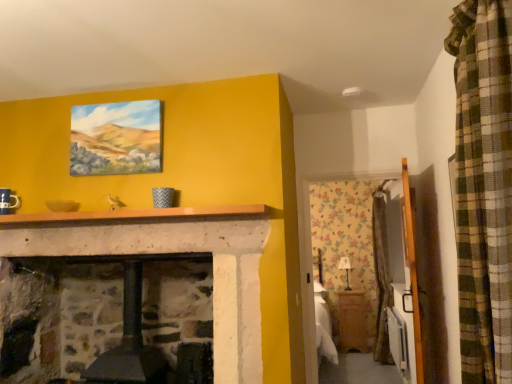
Question: Is wooden cabinet at lower right touching matte canvas painting at upper center?

Choices:
 (A) no
 (B) yes

Answer: (A)

Question: Can you confirm if wooden cabinet at lower right is taller than matte canvas painting at upper center?

Choices:
 (A) yes
 (B) no

Answer: (A)

Question: From the image's perspective, is wooden cabinet at lower right beneath matte canvas painting at upper center?

Choices:
 (A) yes
 (B) no

Answer: (A)

Question: Is matte canvas painting at upper center at the back of wooden cabinet at lower right?

Choices:
 (A) yes
 (B) no

Answer: (B)

Question: Does wooden cabinet at lower right have a lesser height compared to matte canvas painting at upper center?

Choices:
 (A) no
 (B) yes

Answer: (A)

Question: Considering the positions of point (129, 150) and point (416, 292), is point (129, 150) closer or farther from the camera than point (416, 292)?

Choices:
 (A) farther
 (B) closer

Answer: (A)

Question: Relative to wooden armoire at right, is matte canvas painting at upper center in front or behind?

Choices:
 (A) front
 (B) behind

Answer: (B)

Question: Looking at their shapes, would you say matte canvas painting at upper center is wider or thinner than wooden armoire at right?

Choices:
 (A) wide
 (B) thin

Answer: (B)

Question: Visually, is matte canvas painting at upper center positioned to the left or to the right of wooden armoire at right?

Choices:
 (A) left
 (B) right

Answer: (A)

Question: From the image's perspective, is wooden cabinet at lower right above or below wooden armoire at right?

Choices:
 (A) below
 (B) above

Answer: (A)

Question: Considering the relative positions of wooden cabinet at lower right and wooden armoire at right in the image provided, is wooden cabinet at lower right to the left or to the right of wooden armoire at right?

Choices:
 (A) left
 (B) right

Answer: (B)

Question: In the image, is wooden cabinet at lower right positioned in front of or behind wooden armoire at right?

Choices:
 (A) front
 (B) behind

Answer: (B)

Question: Considering the positions of point (347, 296) and point (419, 309), is point (347, 296) closer or farther from the camera than point (419, 309)?

Choices:
 (A) closer
 (B) farther

Answer: (B)

Question: Looking at their shapes, would you say smooth stone mantle at center is wider or thinner than matte canvas painting at upper center?

Choices:
 (A) thin
 (B) wide

Answer: (B)

Question: Considering the positions of point (93, 215) and point (79, 165), is point (93, 215) closer or farther from the camera than point (79, 165)?

Choices:
 (A) closer
 (B) farther

Answer: (A)